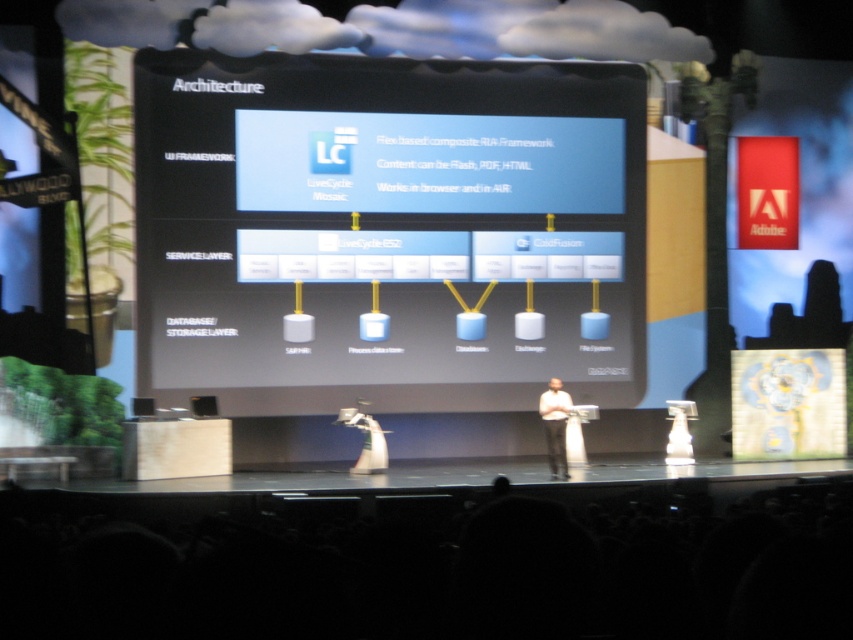
You are an attendee at the conference and you want to take a photo of the speaker. The white fabric dress at center is blocking your view. Can you see the matte black speaker at center over the dress?

The white fabric dress at center is taller than the matte black speaker at center, so you cannot see the matte black speaker at center over the dress.

You are an attendee at the conference and you want to take a photo of the white fabric dress at center and the black matte screen at center. Which object should you focus on first if you want to capture both in one shot without moving the camera?

The black matte screen at center is taller than the white fabric dress at center, so you should focus on the black matte screen at center first to ensure it fits within the frame since it is larger.

You are an architect reviewing the technical architecture slide displayed on the stage. You notice two points marked on the slide at coordinates point [563,410] and point [143,416]. Which point is closer to the camera?

Point [563,410] is further to the camera than point [143,416], so the closer point to the camera is point [143,416].